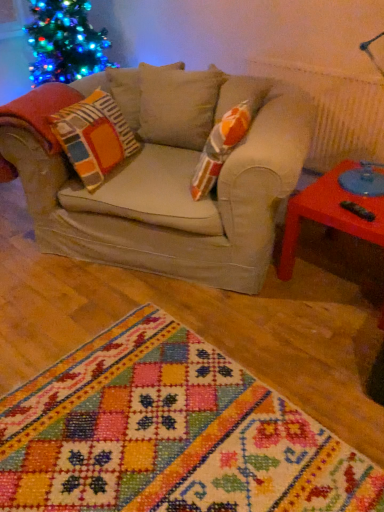
Find the location of a particular element. The width and height of the screenshot is (384, 512). free space in front of rubberized plastic table at right is located at coordinates pos(326,353).